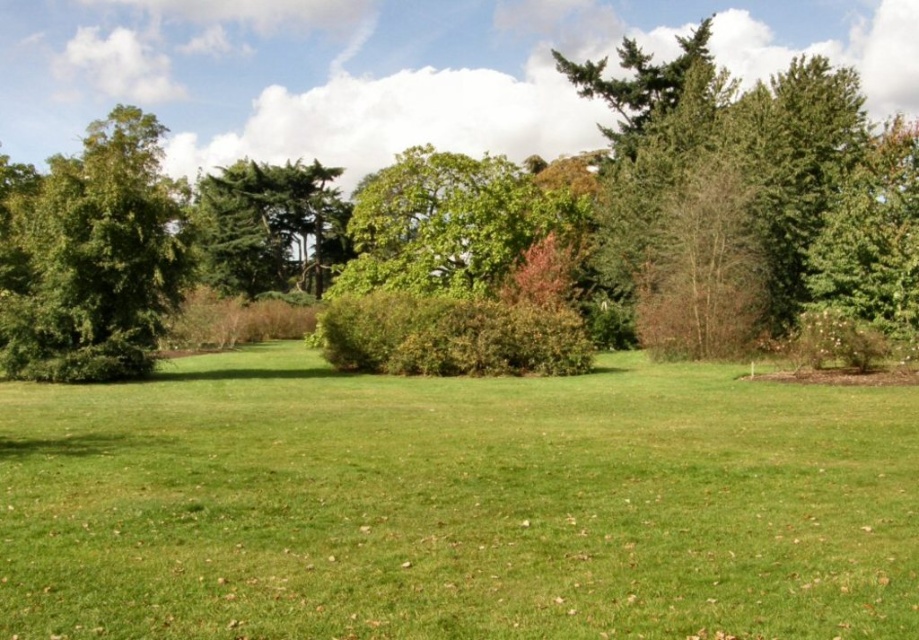
Question: Can you confirm if green grass at center is thinner than green leafy tree at left?

Choices:
 (A) yes
 (B) no

Answer: (B)

Question: Among these points, which one is nearest to the camera?

Choices:
 (A) (24, 253)
 (B) (286, 225)
 (C) (479, 483)
 (D) (339, 13)

Answer: (C)

Question: Does green grass at center have a larger size compared to green textured tree at center?

Choices:
 (A) yes
 (B) no

Answer: (B)

Question: Among these objects, which one is farthest from the camera?

Choices:
 (A) green textured tree at center
 (B) green grass at center
 (C) green leafy tree at center

Answer: (C)

Question: Can you confirm if green leafy tree at center is positioned to the right of green leafy tree at left?

Choices:
 (A) no
 (B) yes

Answer: (B)

Question: Among these objects, which one is nearest to the camera?

Choices:
 (A) green leafy tree at left
 (B) green grass at center

Answer: (B)